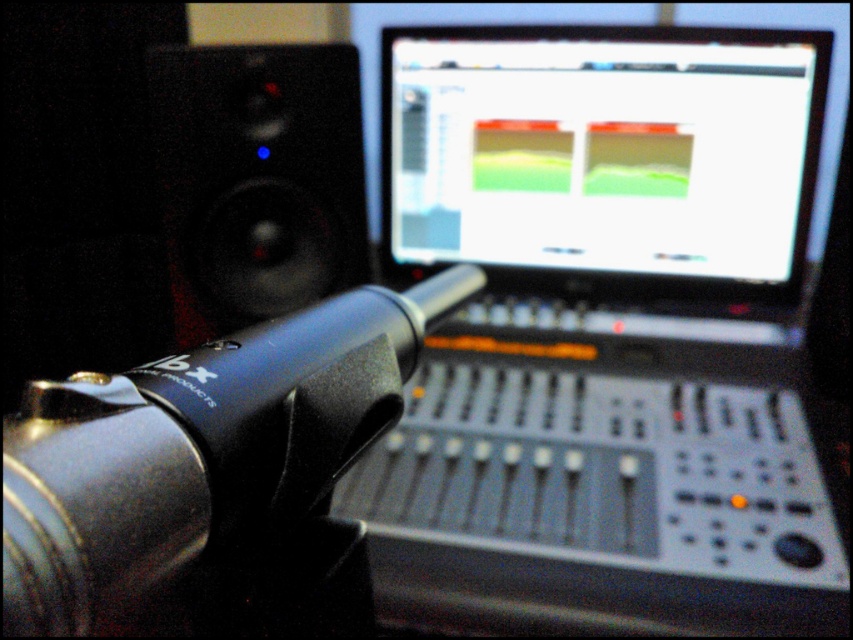
You are a sound engineer setting up equipment in a recording studio. You need to adjust the position of the matte plastic screen at upper center so that it is exactly 1 meter away from the camera. Currently, it is 93.90 centimeters away. Should you move it closer or farther away?

The matte plastic screen at upper center is currently 93.90 centimeters away from the camera. To reach exactly 1 meter, you need to move it farther away by 6.10 centimeters.